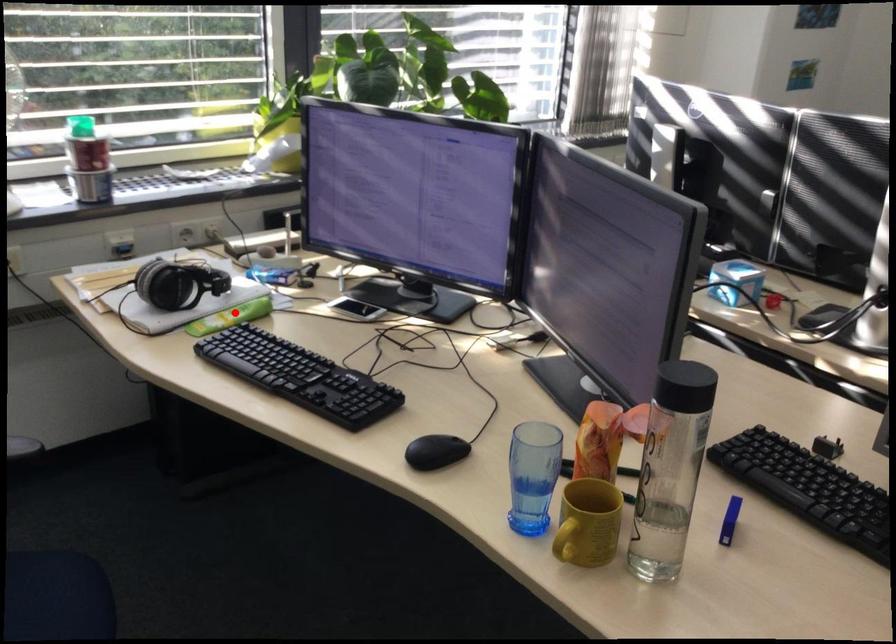
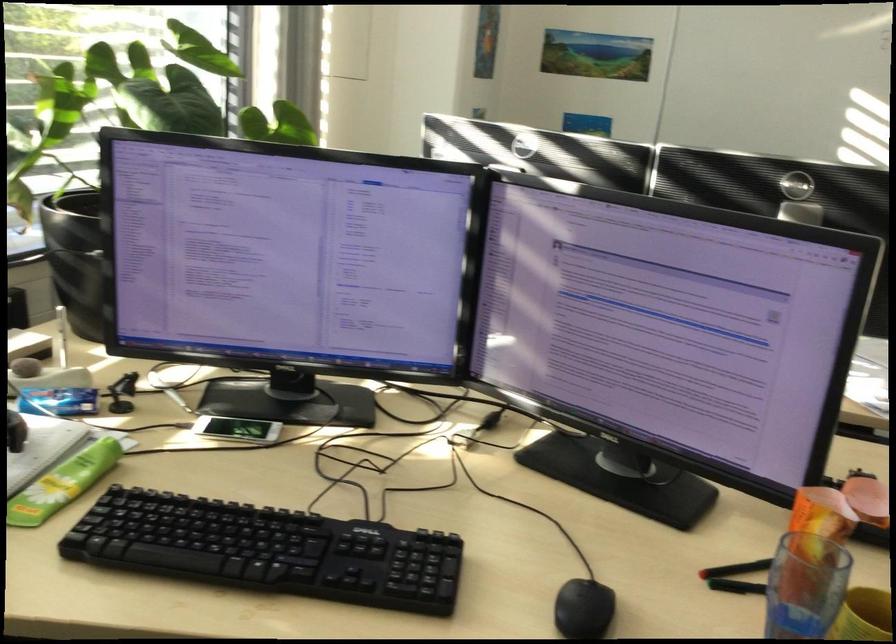
Question: I am providing you with two images of the same scene from different viewpoints. In image1, a red point is highlighted. Considering the same 3D point in image2, which of the following is correct?

Choices:
 (A) It is closer
 (B) It is farther

Answer: (A)